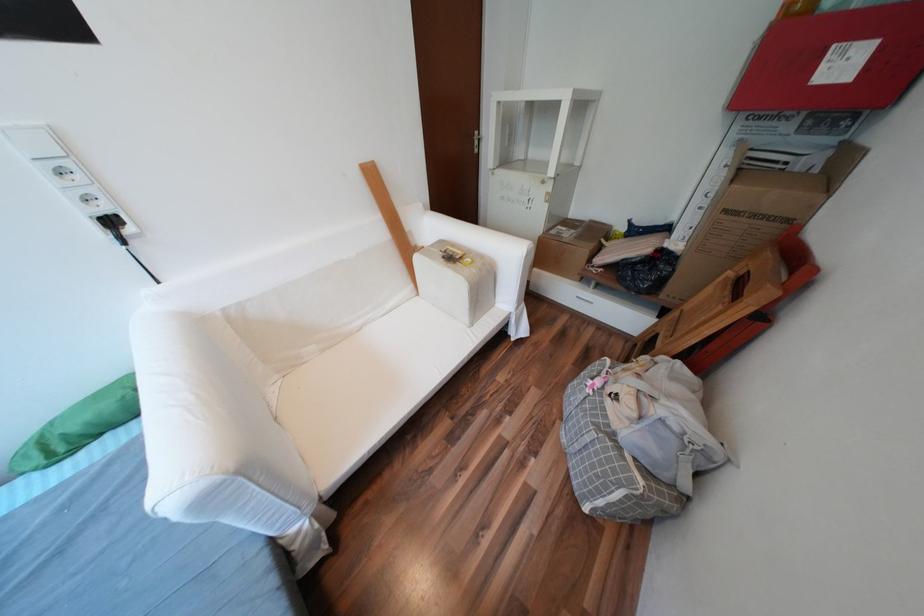
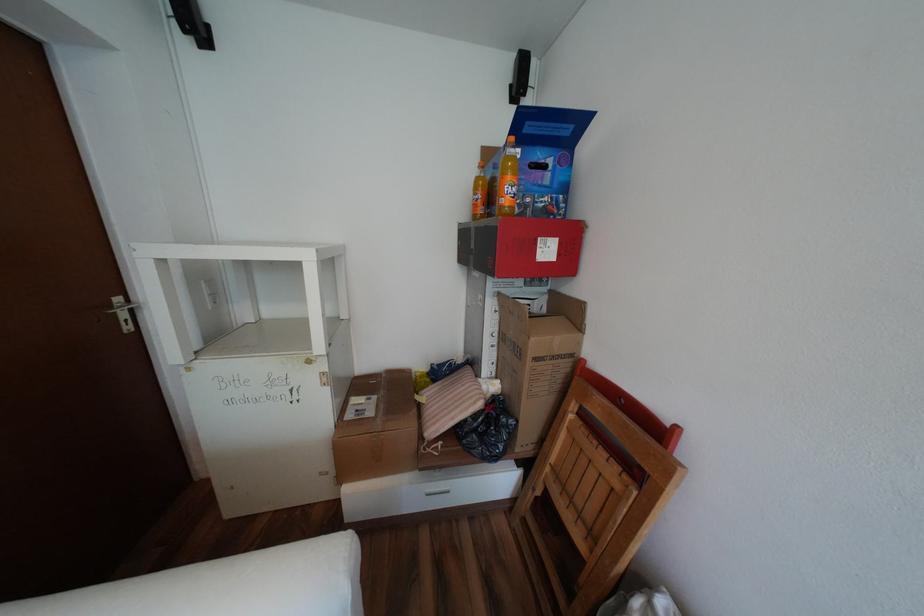
Find the pixel in the second image that matches (853,65) in the first image.

(556, 251)